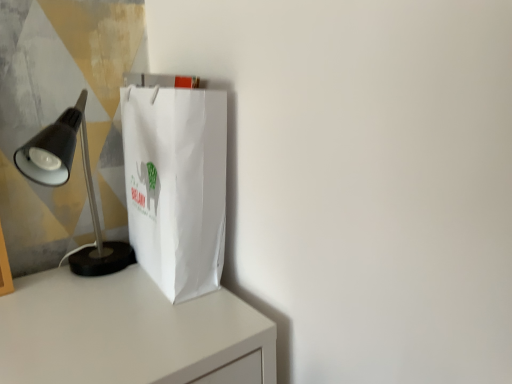
Question: Is matte black lamp at left facing towards white paper bag at center?

Choices:
 (A) yes
 (B) no

Answer: (B)

Question: Does matte black lamp at left touch white paper bag at center?

Choices:
 (A) no
 (B) yes

Answer: (A)

Question: Is matte black lamp at left turned away from white paper bag at center?

Choices:
 (A) yes
 (B) no

Answer: (B)

Question: Considering the relative sizes of matte black lamp at left and white paper bag at center in the image provided, is matte black lamp at left bigger than white paper bag at center?

Choices:
 (A) no
 (B) yes

Answer: (B)

Question: Is white paper bag at center surrounded by matte black lamp at left?

Choices:
 (A) no
 (B) yes

Answer: (A)

Question: From the image's perspective, is matte black lamp at left located above white paper bag at center?

Choices:
 (A) no
 (B) yes

Answer: (A)

Question: Does white paper bag at center turn towards matte black lamp at left?

Choices:
 (A) no
 (B) yes

Answer: (B)

Question: Is white paper bag at center not close to matte black lamp at left?

Choices:
 (A) no
 (B) yes

Answer: (A)

Question: Is white paper bag at center beside matte black lamp at left?

Choices:
 (A) no
 (B) yes

Answer: (A)

Question: Does white paper bag at center come in front of matte black lamp at left?

Choices:
 (A) yes
 (B) no

Answer: (B)

Question: From a real-world perspective, is white paper bag at center located higher than matte black lamp at left?

Choices:
 (A) no
 (B) yes

Answer: (B)

Question: Can you confirm if white paper bag at center is positioned to the left of matte black lamp at left?

Choices:
 (A) yes
 (B) no

Answer: (B)

Question: Is matte black lamp at left to the left or to the right of white paper bag at center in the image?

Choices:
 (A) left
 (B) right

Answer: (A)